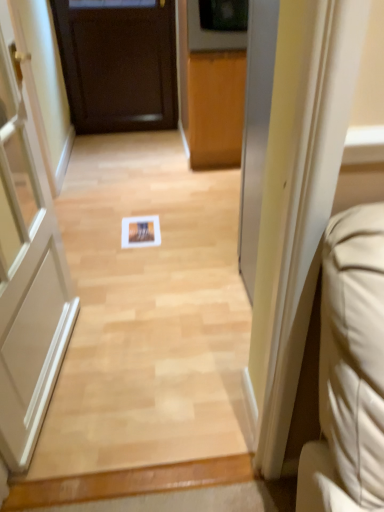
The image size is (384, 512). In order to click on vacant space underneath white matte door at left, positioned as the 2th door in top-to-bottom order (from a real-world perspective) in this screenshot , I will do `click(62, 379)`.